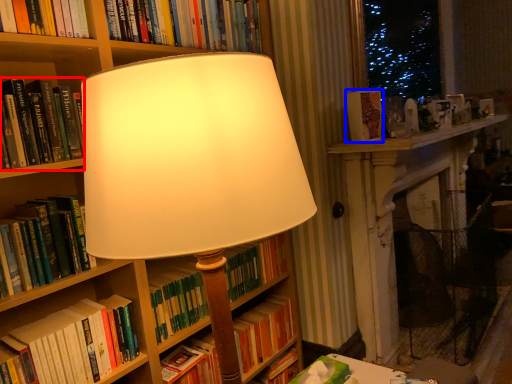
Question: Which object appears farthest to the camera in this image, book (highlighted by a red box) or book (highlighted by a blue box)?

Choices:
 (A) book
 (B) book

Answer: (B)